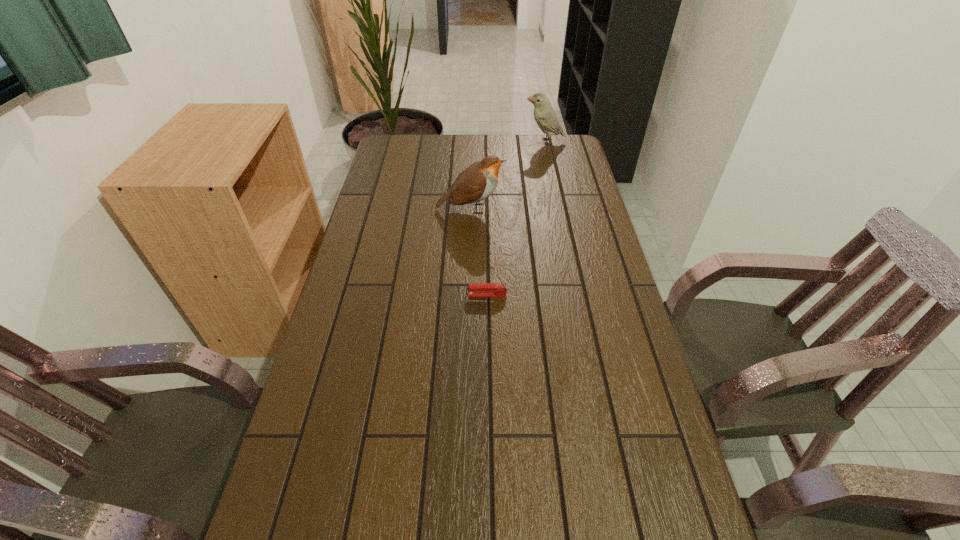
Identify the location of vacant position located on the front-facing side of the shortest object. (411, 295).

Where is `free space located 0.370m on the front-facing side of the shortest object`? This screenshot has height=540, width=960. free space located 0.370m on the front-facing side of the shortest object is located at coordinates (335, 295).

This screenshot has height=540, width=960. I want to click on free space located on the front-facing side of the shortest object, so click(x=396, y=295).

Locate an element on the screen. object present at the far edge is located at coordinates (544, 114).

Identify the location of object that is at the right edge. The image size is (960, 540). (544, 114).

Where is `object that is positioned at the far right corner`? object that is positioned at the far right corner is located at coordinates (544, 114).

Find the location of a particular element. free region at the left edge is located at coordinates (376, 376).

Locate an element on the screen. free location at the right edge is located at coordinates [x=563, y=225].

Find the location of a particular element. The image size is (960, 540). free space at the far left corner of the desktop is located at coordinates (407, 143).

The image size is (960, 540). I want to click on free location at the far right corner of the desktop, so click(574, 164).